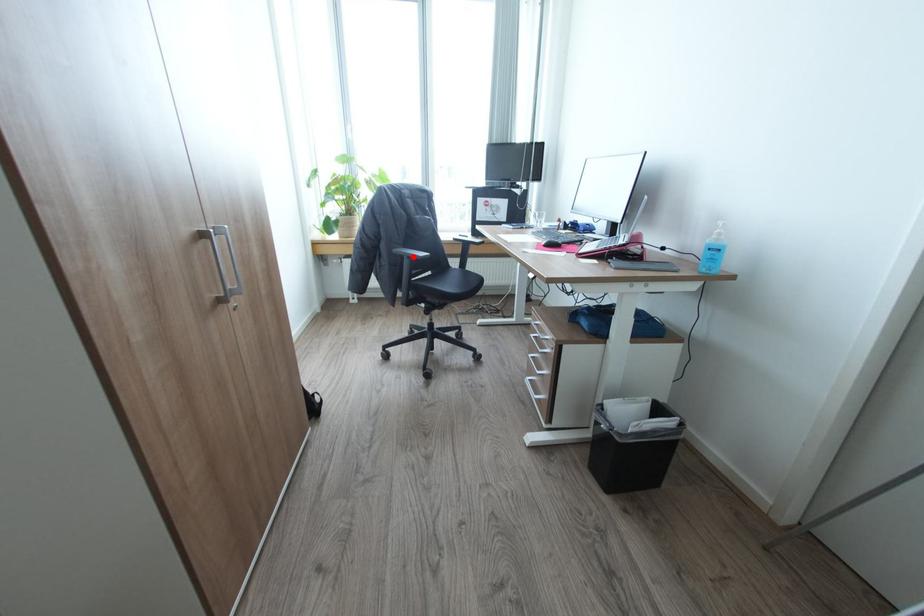
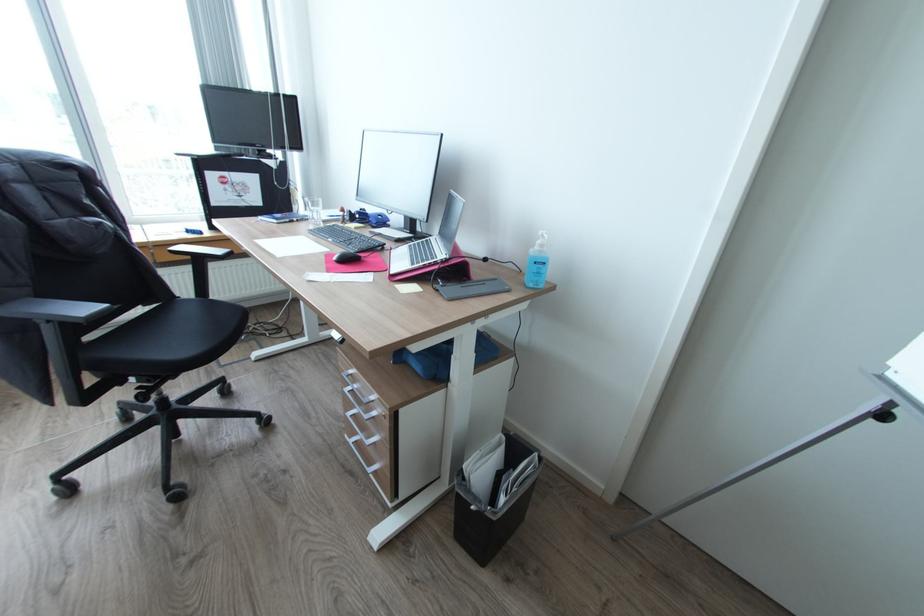
In the second image, find the point that corresponds to the highlighted location in the first image.

(55, 321)